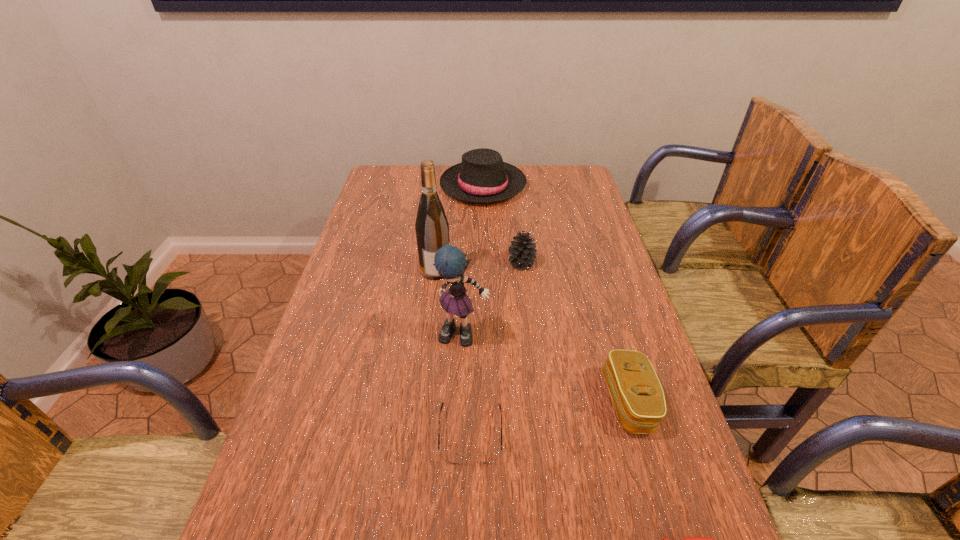
This screenshot has width=960, height=540. I want to click on wine bottle, so click(432, 228).

Where is `the fourth farthest object`? the fourth farthest object is located at coordinates (450, 262).

In order to click on the sixth shortest object in this screenshot , I will do `click(450, 262)`.

Find the location of a particular element. Image resolution: width=960 pixels, height=540 pixels. the farthest object is located at coordinates (482, 177).

I want to click on pinecone, so click(522, 251).

Find the location of `clutch bag`. clutch bag is located at coordinates (637, 394).

Where is `the second shortest object`? Image resolution: width=960 pixels, height=540 pixels. the second shortest object is located at coordinates (454, 458).

Where is `vacant area situated on the front of the tallest object`? This screenshot has width=960, height=540. vacant area situated on the front of the tallest object is located at coordinates (422, 383).

Identify the location of free spot located 0.060m on the front-facing side of the rag doll. (463, 369).

The height and width of the screenshot is (540, 960). I want to click on vacant space located 0.130m on the left of the dress hat, so click(406, 185).